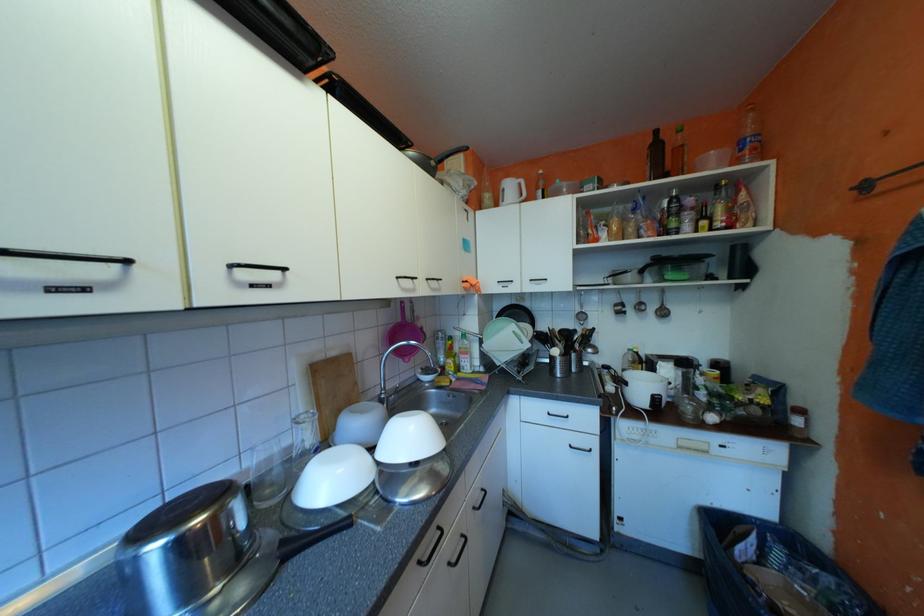
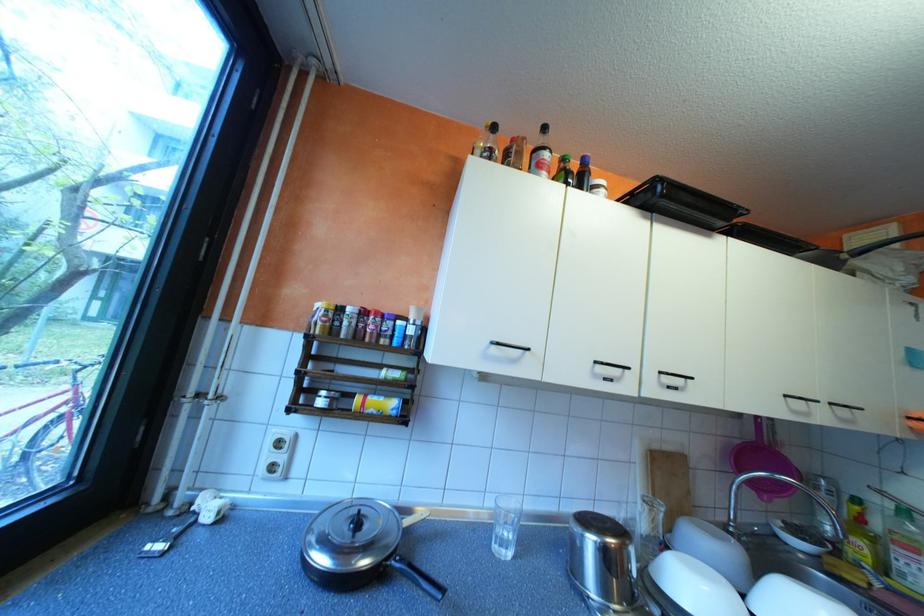
Where in the second image is the point corresponding to point 408,276 from the first image?

(797, 395)